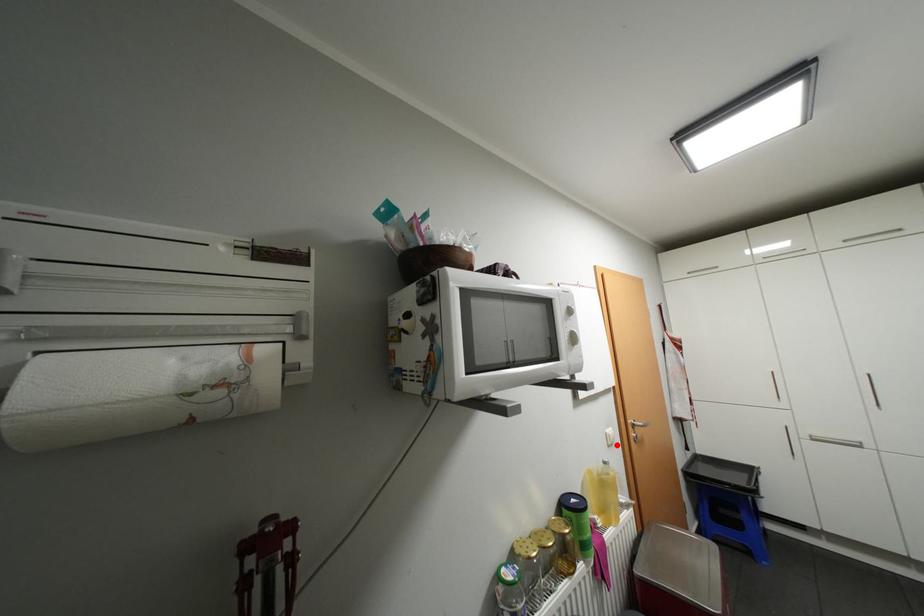
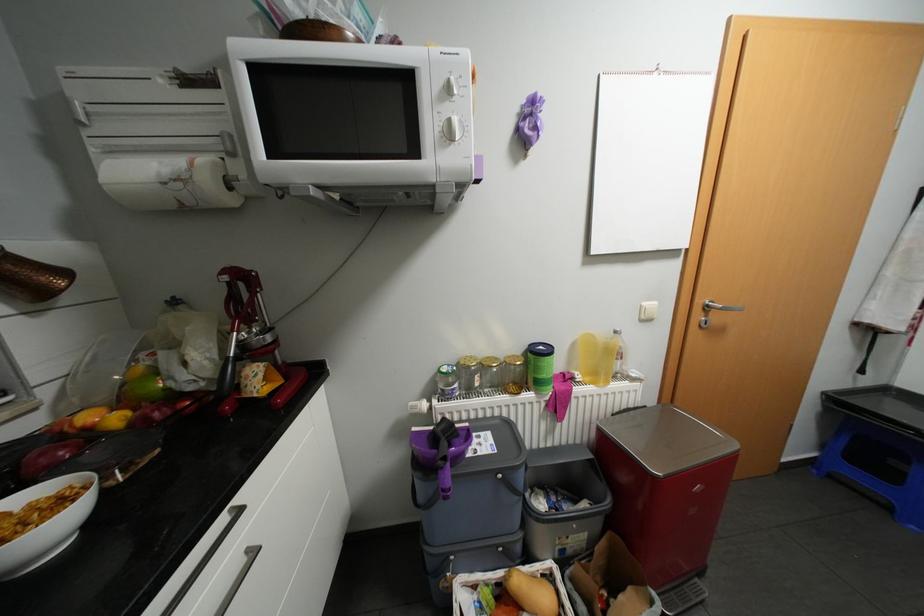
Question: I am providing you with two images of the same scene from different viewpoints. A red point is shown in image1. For the corresponding object point in image2, is it positioned nearer or farther from the camera?

Choices:
 (A) Nearer
 (B) Farther

Answer: (A)